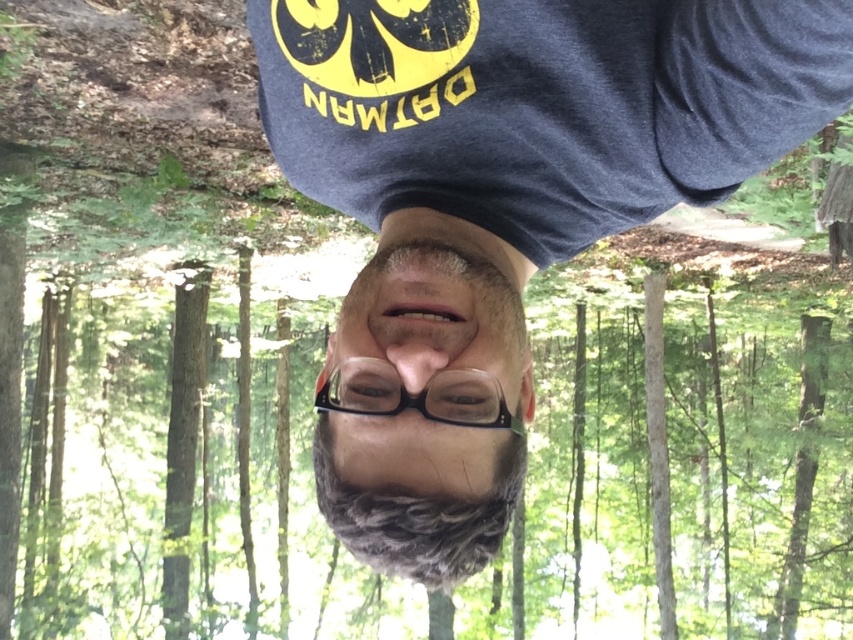
Question: Is dark blue t-shirt at center in front of gray matte hair at center?

Choices:
 (A) yes
 (B) no

Answer: (A)

Question: In this image, where is dark blue t-shirt at center located relative to gray matte hair at center?

Choices:
 (A) left
 (B) right

Answer: (B)

Question: Which point is farther from the camera taking this photo?

Choices:
 (A) (358, 385)
 (B) (405, 276)

Answer: (B)

Question: Which object is closer to the camera taking this photo?

Choices:
 (A) gray matte hair at center
 (B) dark blue t-shirt at center

Answer: (B)

Question: In this image, where is dark blue t-shirt at center located relative to gray matte hair at center?

Choices:
 (A) left
 (B) right

Answer: (B)

Question: Which point appears farthest from the camera in this image?

Choices:
 (A) (445, 584)
 (B) (704, 180)

Answer: (B)